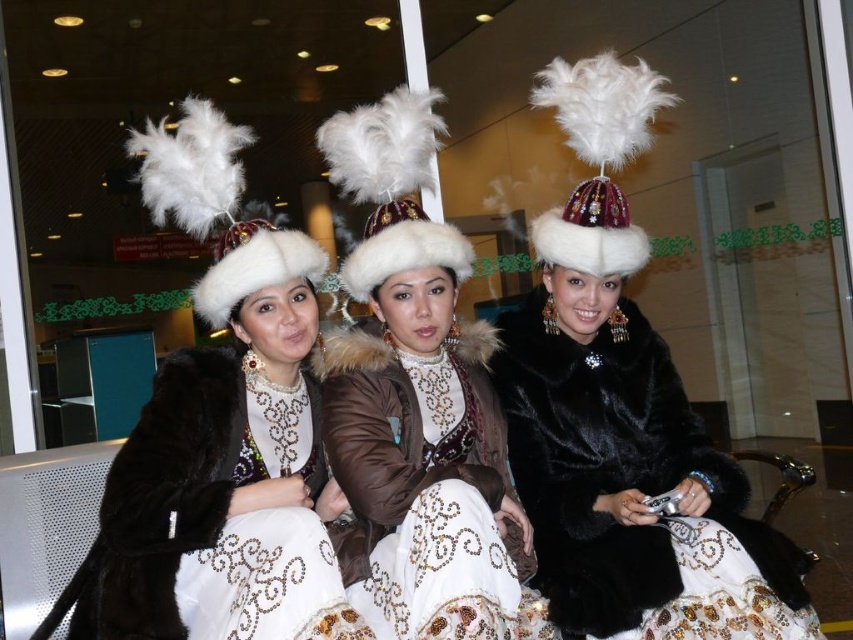
You are standing in the same room as the women in the image. If you want to walk towards the two points marked in the scene, which point would you reach first, point (392, 448) or point (544, 448)?

You would reach point (392, 448) first because it is closer to you than point (544, 448).

You are a photographer standing in the scene. You want to take a closeup photo of the matte black fur coat at left without moving any objects. Can you step forward to get closer?

The matte black fur coat at left and viewer are 4.11 feet apart, so yes, you can step forward to get closer as the distance allows for movement towards the coat.

In the scene shown: You are standing in the airport and see two points marked on the floor. The first point is at coordinate point (277, 472) and the second point is at coordinate point (614, 476). Which point is closer to you?

Point (277, 472) is in front of point (614, 476), so it is closer to you.